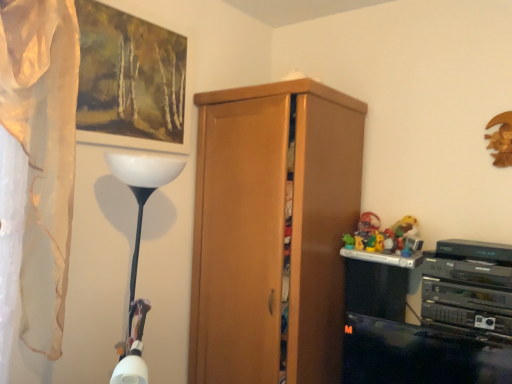
Question: Is wooden cabinet at center to the right of white sheer curtain at left from the viewer's perspective?

Choices:
 (A) yes
 (B) no

Answer: (A)

Question: Can you confirm if wooden cabinet at center is positioned to the left of white sheer curtain at left?

Choices:
 (A) yes
 (B) no

Answer: (B)

Question: Is wooden cabinet at center placed right next to white sheer curtain at left?

Choices:
 (A) yes
 (B) no

Answer: (B)

Question: Can you confirm if wooden cabinet at center is smaller than white sheer curtain at left?

Choices:
 (A) yes
 (B) no

Answer: (B)

Question: Does wooden cabinet at center lie behind white sheer curtain at left?

Choices:
 (A) yes
 (B) no

Answer: (A)

Question: Is wooden cabinet at center shorter than white sheer curtain at left?

Choices:
 (A) yes
 (B) no

Answer: (B)

Question: Is wooden cabinet at center inside white sheer curtain at left?

Choices:
 (A) no
 (B) yes

Answer: (A)

Question: Is white sheer curtain at left bigger than wooden cabinet at center?

Choices:
 (A) yes
 (B) no

Answer: (B)

Question: From a real-world perspective, is white sheer curtain at left physically below wooden cabinet at center?

Choices:
 (A) no
 (B) yes

Answer: (A)

Question: Is white sheer curtain at left next to wooden cabinet at center?

Choices:
 (A) no
 (B) yes

Answer: (A)

Question: Is white sheer curtain at left positioned before wooden cabinet at center?

Choices:
 (A) no
 (B) yes

Answer: (B)

Question: From the image's perspective, does white sheer curtain at left appear higher than wooden cabinet at center?

Choices:
 (A) no
 (B) yes

Answer: (B)

Question: Is wooden picture frame at upper left to the right of white sheer curtain at left from the viewer's perspective?

Choices:
 (A) no
 (B) yes

Answer: (B)